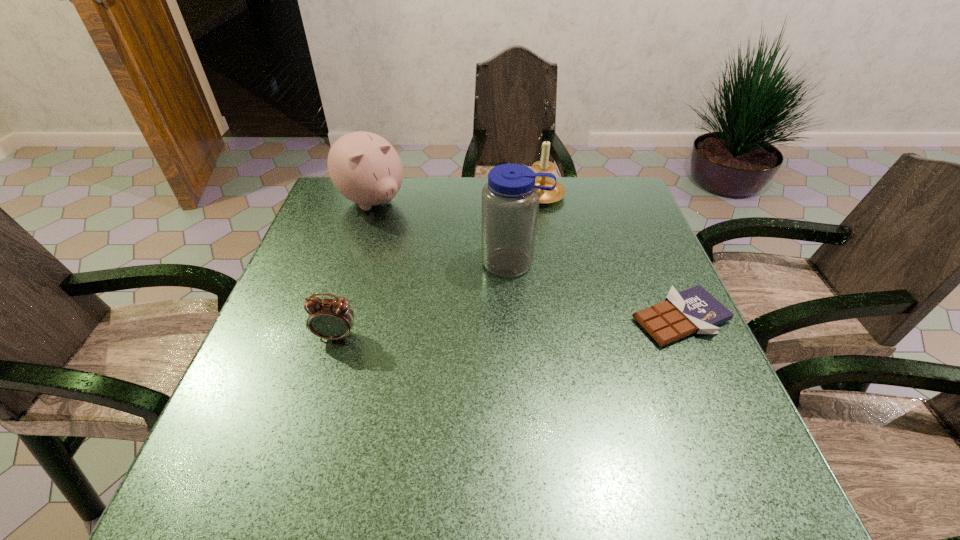
Where is `vacant point that satisfies the following two spatial constraints: 1. on the front side of the piggy bank; 2. on the right side of the tallest object`? vacant point that satisfies the following two spatial constraints: 1. on the front side of the piggy bank; 2. on the right side of the tallest object is located at coordinates (352, 262).

Where is `vacant space that satisfies the following two spatial constraints: 1. on the front side of the candle holder; 2. on the right side of the chocolate bar`? vacant space that satisfies the following two spatial constraints: 1. on the front side of the candle holder; 2. on the right side of the chocolate bar is located at coordinates (564, 319).